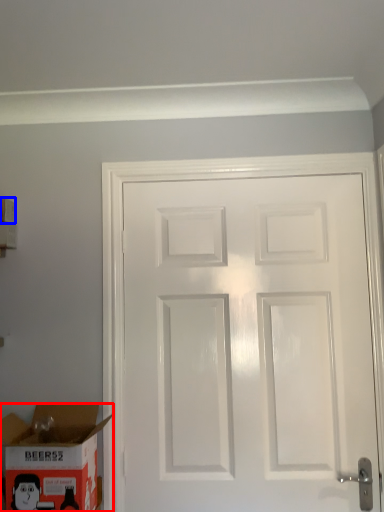
Question: Which point is closer to the camera, box (highlighted by a red box) or box (highlighted by a blue box)?

Choices:
 (A) box
 (B) box

Answer: (A)